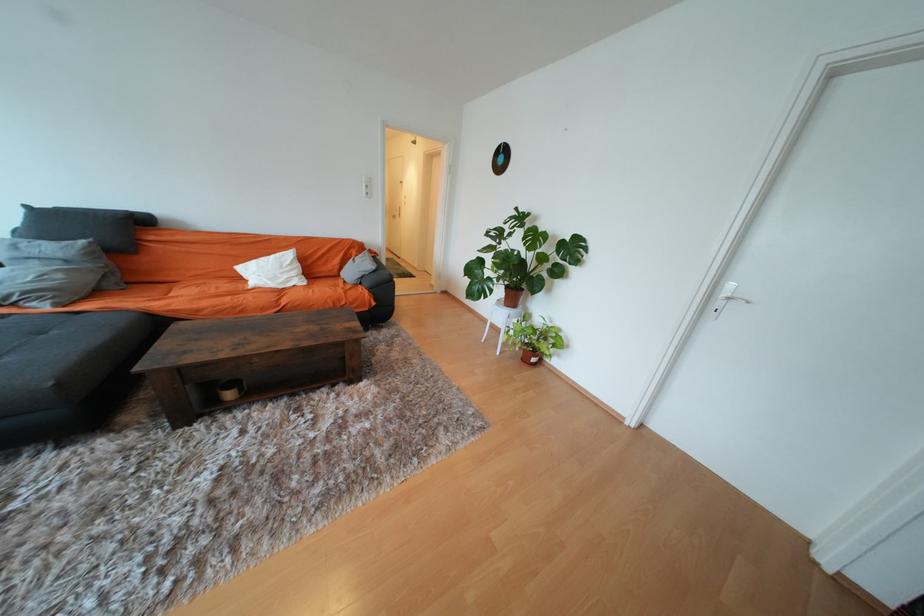
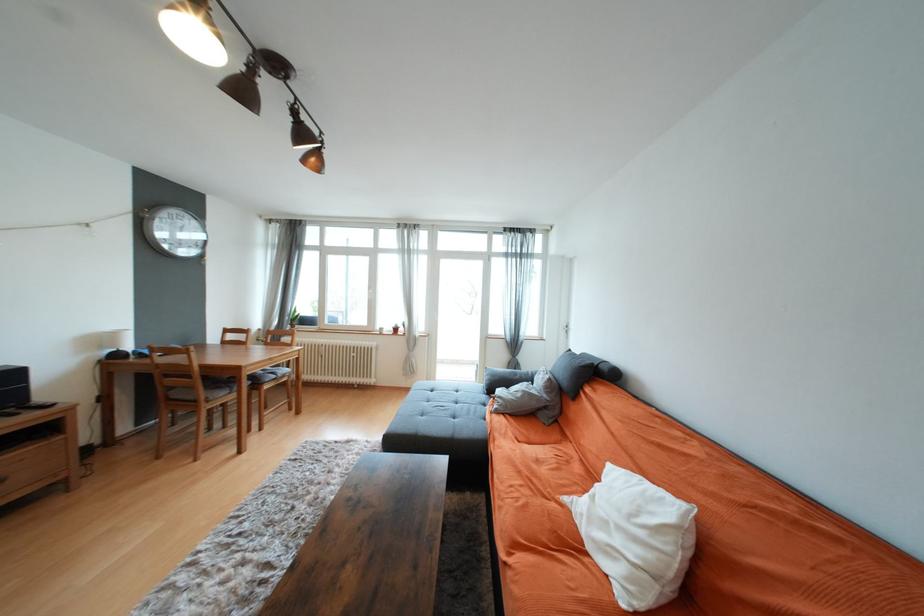
Locate, in the second image, the point that corresponds to point (287, 275) in the first image.

(625, 530)